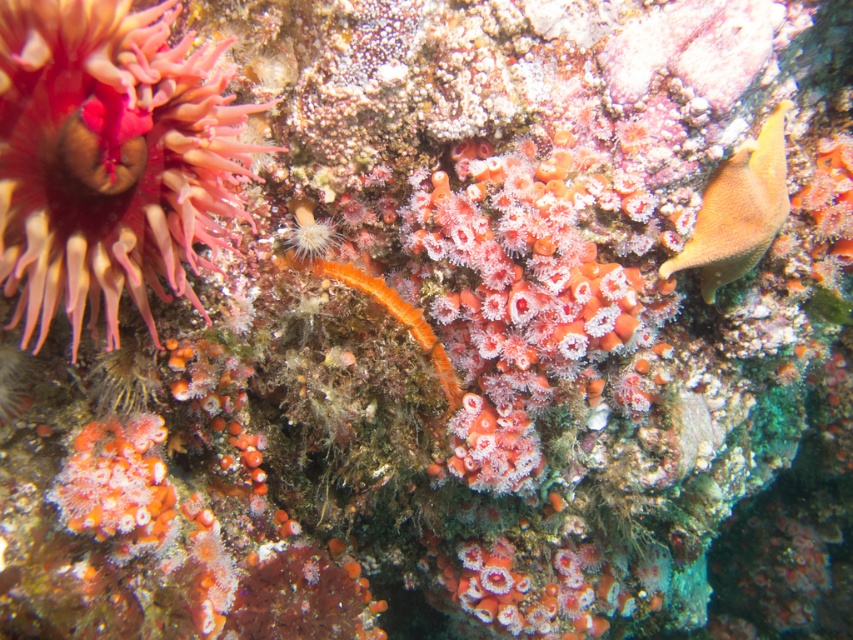
Is point (177, 120) closer to camera compared to point (764, 214)?

Yes.

Who is positioned more to the right, matte pink coral at upper left or smooth orange fish at right?

Positioned to the right is smooth orange fish at right.

Between point (16, 310) and point (758, 259), which one is positioned in front?

Positioned in front is point (16, 310).

Locate an element on the screen. matte pink coral at upper left is located at coordinates (109, 157).